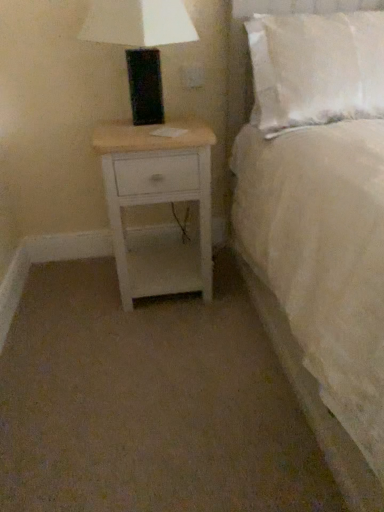
Question: Relative to white soft pillow at upper right, is matte black lamp at upper left in front or behind?

Choices:
 (A) front
 (B) behind

Answer: (B)

Question: Choose the correct answer: Is matte black lamp at upper left inside white soft pillow at upper right or outside it?

Choices:
 (A) outside
 (B) inside

Answer: (A)

Question: Estimate the real-world distances between objects in this image. Which object is farther from the white wood nightstand at lower left?

Choices:
 (A) white soft pillow at upper right
 (B) white soft bed at upper right
 (C) matte black lamp at upper left
 (D) white plastic outlet at upper center

Answer: (D)

Question: Which is farther from the white wood nightstand at lower left?

Choices:
 (A) matte black lamp at upper left
 (B) white plastic outlet at upper center
 (C) white soft bed at upper right
 (D) white soft pillow at upper right

Answer: (B)